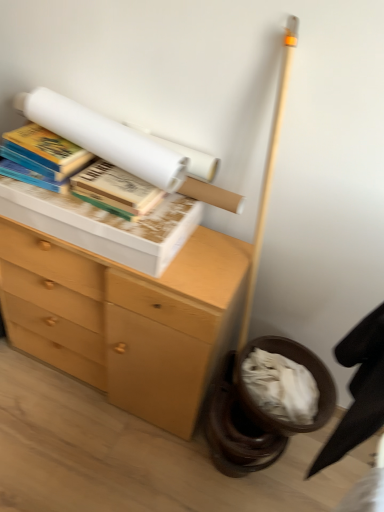
Question: Is wooden chest of drawers at left closer to camera compared to hardcover book at upper left, which is counted as the third book, starting from the right?

Choices:
 (A) no
 (B) yes

Answer: (B)

Question: From the image's perspective, is wooden chest of drawers at left under hardcover book at upper left, which is counted as the third book, starting from the right?

Choices:
 (A) no
 (B) yes

Answer: (B)

Question: Is wooden chest of drawers at left directly adjacent to hardcover book at upper left, which ranks as the 1th book in left-to-right order?

Choices:
 (A) yes
 (B) no

Answer: (B)

Question: Considering the relative sizes of wooden chest of drawers at left and hardcover book at upper left, which ranks as the 1th book in left-to-right order, in the image provided, is wooden chest of drawers at left shorter than hardcover book at upper left, which ranks as the 1th book in left-to-right order,?

Choices:
 (A) no
 (B) yes

Answer: (A)

Question: From the image's perspective, would you say wooden chest of drawers at left is positioned over hardcover book at upper left, which is counted as the third book, starting from the right?

Choices:
 (A) no
 (B) yes

Answer: (A)

Question: Is wooden chest of drawers at left bigger than hardcover book at upper left, which ranks as the 1th book in left-to-right order?

Choices:
 (A) yes
 (B) no

Answer: (A)

Question: Is hardcover book at upper left, the 1th book from the right, positioned behind black fabric swivel chair at lower right?

Choices:
 (A) no
 (B) yes

Answer: (B)

Question: From a real-world perspective, is hardcover book at upper left, which ranks as the 3th book in left-to-right order, physically above black fabric swivel chair at lower right?

Choices:
 (A) no
 (B) yes

Answer: (B)

Question: From a real-world perspective, is hardcover book at upper left, the 1th book from the right, under black fabric swivel chair at lower right?

Choices:
 (A) no
 (B) yes

Answer: (A)

Question: Could you tell me if hardcover book at upper left, the 1th book from the right, is facing black fabric swivel chair at lower right?

Choices:
 (A) no
 (B) yes

Answer: (A)

Question: Can you confirm if hardcover book at upper left, which ranks as the 3th book in left-to-right order, is smaller than black fabric swivel chair at lower right?

Choices:
 (A) yes
 (B) no

Answer: (A)

Question: From the image's perspective, is hardcover book at upper left, which ranks as the 3th book in left-to-right order, below black fabric swivel chair at lower right?

Choices:
 (A) no
 (B) yes

Answer: (A)

Question: Could you tell me if white paper at upper center, arranged as the 2th book when viewed from the left, is turned towards hardcover book at upper left, which is counted as the third book, starting from the right?

Choices:
 (A) yes
 (B) no

Answer: (B)